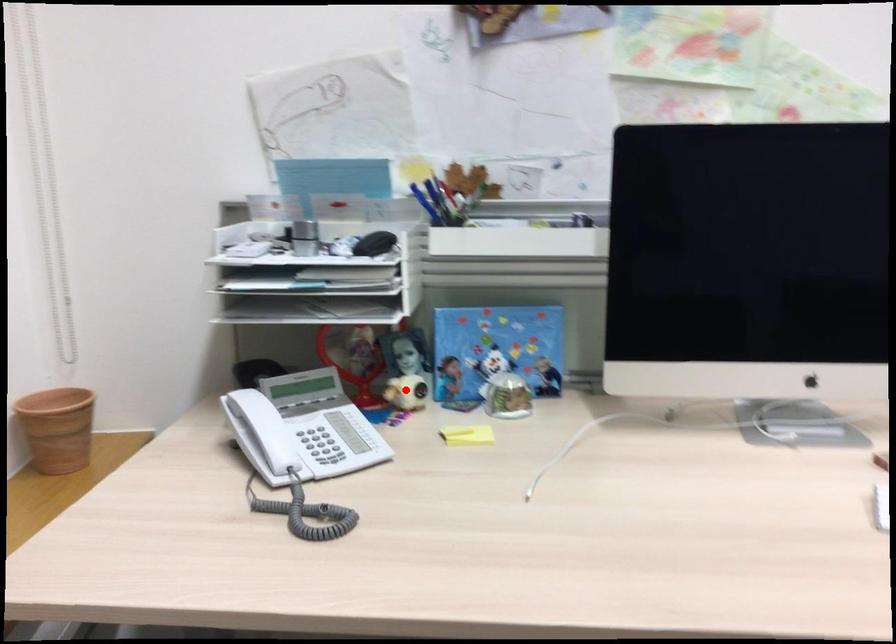
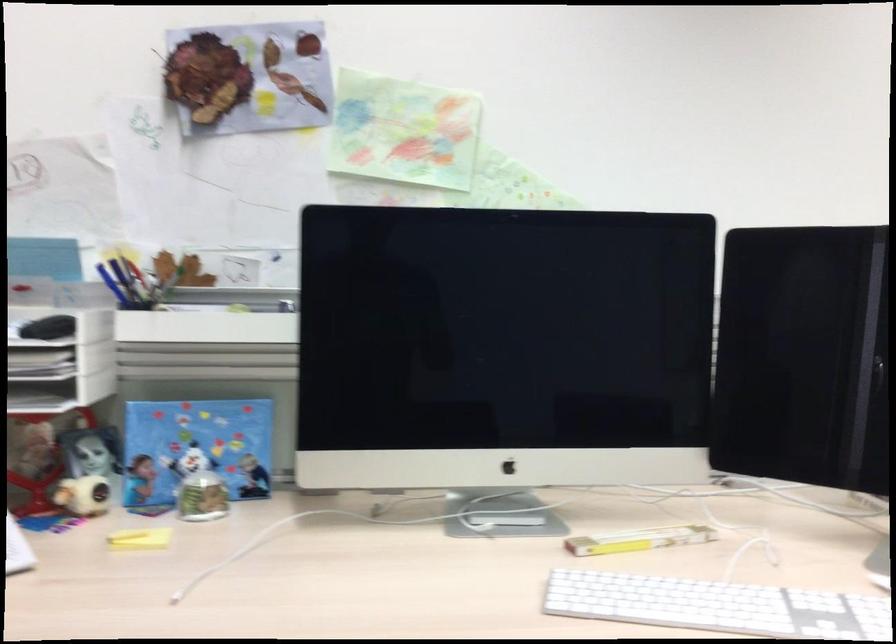
Locate, in the second image, the point that corresponds to the highlighted location in the first image.

(83, 495)